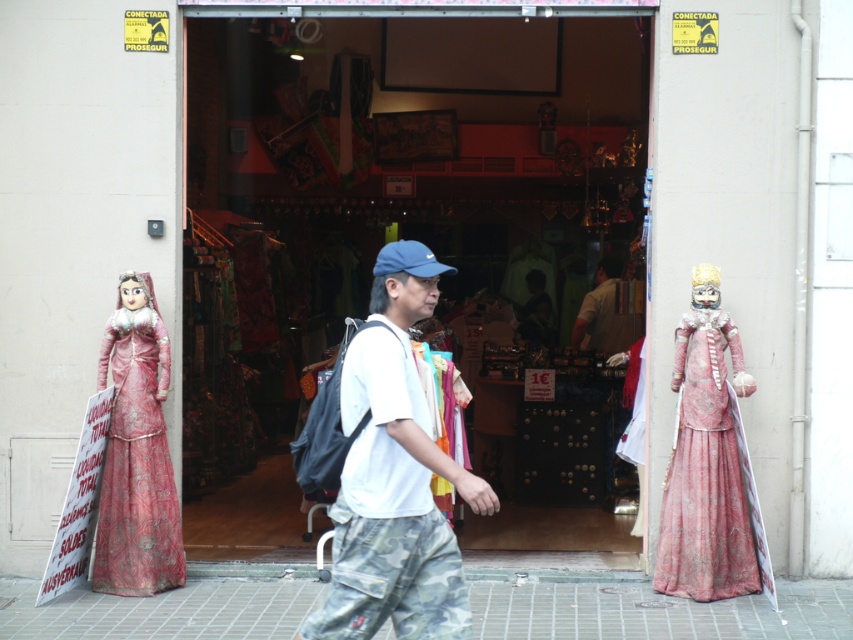
Measure the distance between point (454, 566) and camera.

Point (454, 566) is 5.61 meters from camera.

Does point (444, 460) lie behind point (730, 388)?

No, (444, 460) is closer to viewer.

Locate an element on the screen. This screenshot has height=640, width=853. white cotton shirt at center is located at coordinates (393, 476).

Does brick pavement at center come in front of matte pink fabric dress at left?

Yes.

Is brick pavement at center wider than matte pink fabric dress at left?

Correct, the width of brick pavement at center exceeds that of matte pink fabric dress at left.

Between point (793, 595) and point (126, 586), which one is positioned in front?

Positioned in front is point (793, 595).

This screenshot has height=640, width=853. Identify the location of brick pavement at center. (654, 611).

Can you confirm if matte pink fabric dress at right is thinner than matte pink fabric dress at left?

No, matte pink fabric dress at right is not thinner than matte pink fabric dress at left.

Is matte pink fabric dress at right to the right of matte pink fabric dress at left from the viewer's perspective?

Indeed, matte pink fabric dress at right is positioned on the right side of matte pink fabric dress at left.

Between point (734, 538) and point (178, 552), which one is positioned behind?

The point (178, 552) is behind.

This screenshot has width=853, height=640. What are the coordinates of `matte pink fabric dress at right` in the screenshot? It's located at (706, 474).